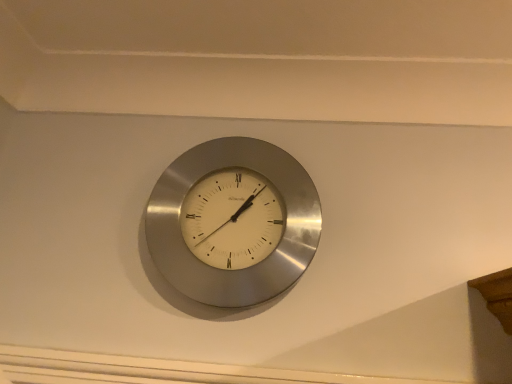
This screenshot has width=512, height=384. What do you see at coordinates (250, 267) in the screenshot?
I see `satin silver clock at center` at bounding box center [250, 267].

Measure the distance between point (158, 190) and camera.

28.78 inches.

What is the approximate width of satin silver clock at center?

satin silver clock at center is 2.91 inches wide.

This screenshot has height=384, width=512. What are the coordinates of `satin silver clock at center` in the screenshot? It's located at (250, 267).

Identify the location of satin silver clock at center. (250, 267).